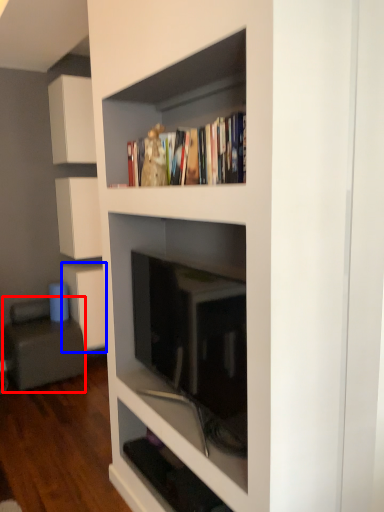
Question: Among these objects, which one is nearest to the camera, armchair (highlighted by a red box) or cabinetry (highlighted by a blue box)?

Choices:
 (A) armchair
 (B) cabinetry

Answer: (A)